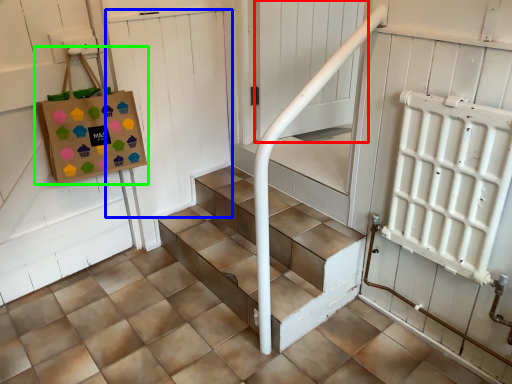
Question: Which object is the farthest from screen door (highlighted by a red box)? Choose among these: door (highlighted by a blue box) or bag (highlighted by a green box).

Choices:
 (A) door
 (B) bag

Answer: (B)